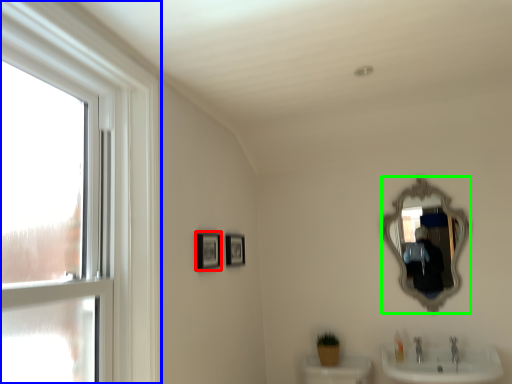
Question: Which object is the closest to the picture frame (highlighted by a red box)? Choose among these: window (highlighted by a blue box) or mirror (highlighted by a green box).

Choices:
 (A) window
 (B) mirror

Answer: (A)